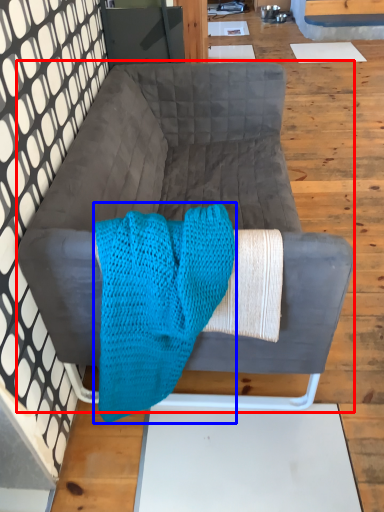
Question: Which point is further to the camera, studio couch (highlighted by a red box) or blanket (highlighted by a blue box)?

Choices:
 (A) studio couch
 (B) blanket

Answer: (A)